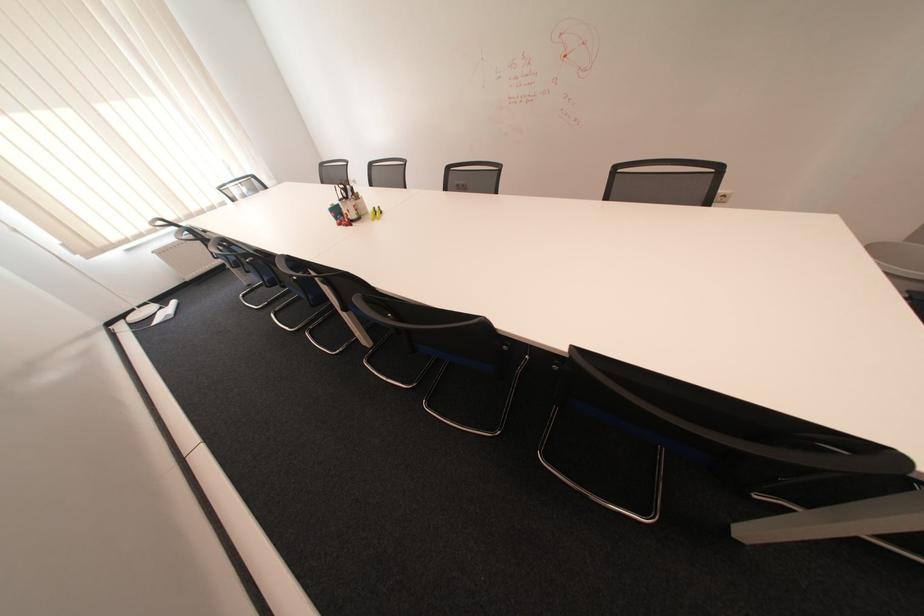
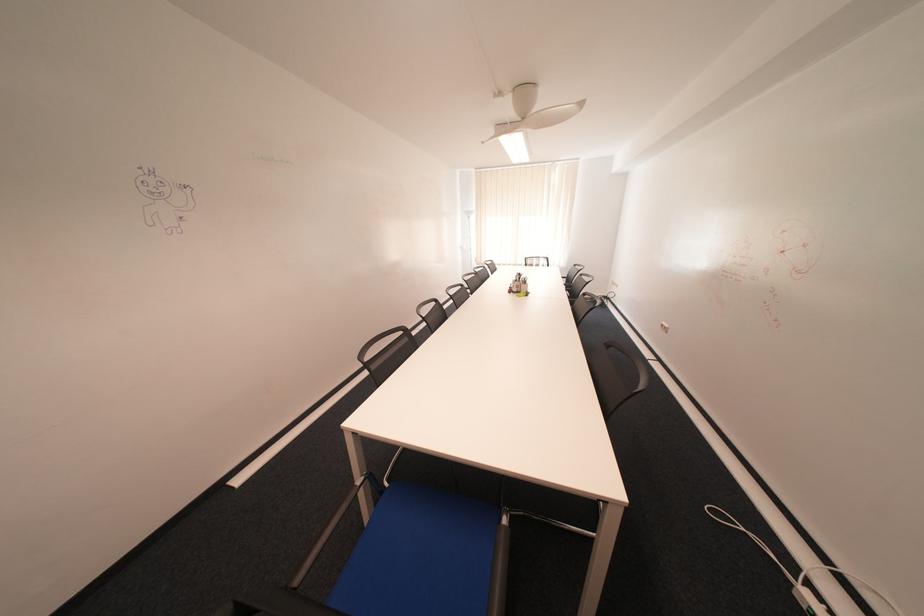
The point at (363, 217) is marked in the first image. Where is the corresponding point in the second image?

(526, 290)